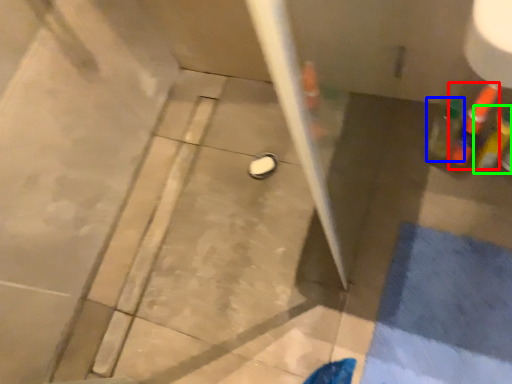
Question: Which is nearer to the bottle (highlighted by a red box)? bottle (highlighted by a blue box) or bottle (highlighted by a green box).

Choices:
 (A) bottle
 (B) bottle

Answer: (B)